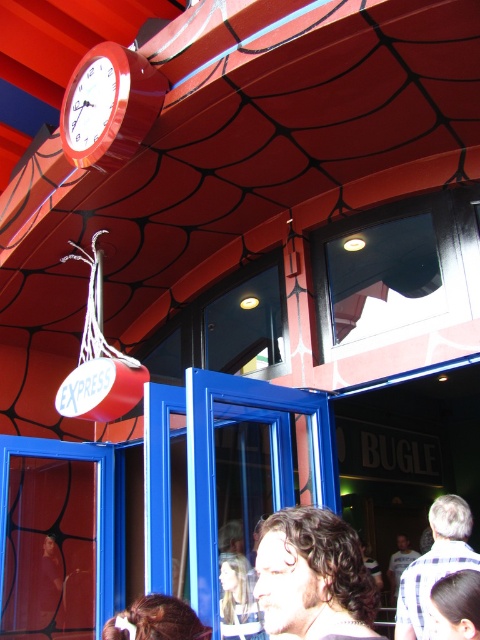
Does transparent glass window at upper center appear under blue glass door at lower center?

Actually, transparent glass window at upper center is above blue glass door at lower center.

Can you confirm if transparent glass window at upper center is shorter than blue glass door at lower center?

Correct, transparent glass window at upper center is not as tall as blue glass door at lower center.

Who is more distant from viewer, (361, 220) or (335, 449)?

Point (361, 220)

Locate an element on the screen. The image size is (480, 640). transparent glass window at upper center is located at coordinates (396, 268).

Who is positioned more to the right, transparent glass window at center or dark brown hair at center?

dark brown hair at center is more to the right.

Does transparent glass window at center appear on the left side of dark brown hair at center?

Yes, transparent glass window at center is to the left of dark brown hair at center.

Where is `transparent glass window at center`? Image resolution: width=480 pixels, height=640 pixels. transparent glass window at center is located at coordinates tap(225, 324).

Does dark curly hair at center have a greater width compared to gray checkered shirt at lower right?

No.

Is dark curly hair at center to the right of gray checkered shirt at lower right from the viewer's perspective?

No, dark curly hair at center is not to the right of gray checkered shirt at lower right.

Where is `dark curly hair at center`? The width and height of the screenshot is (480, 640). dark curly hair at center is located at coordinates (312, 576).

Where is `dark curly hair at center`? The width and height of the screenshot is (480, 640). dark curly hair at center is located at coordinates (312, 576).